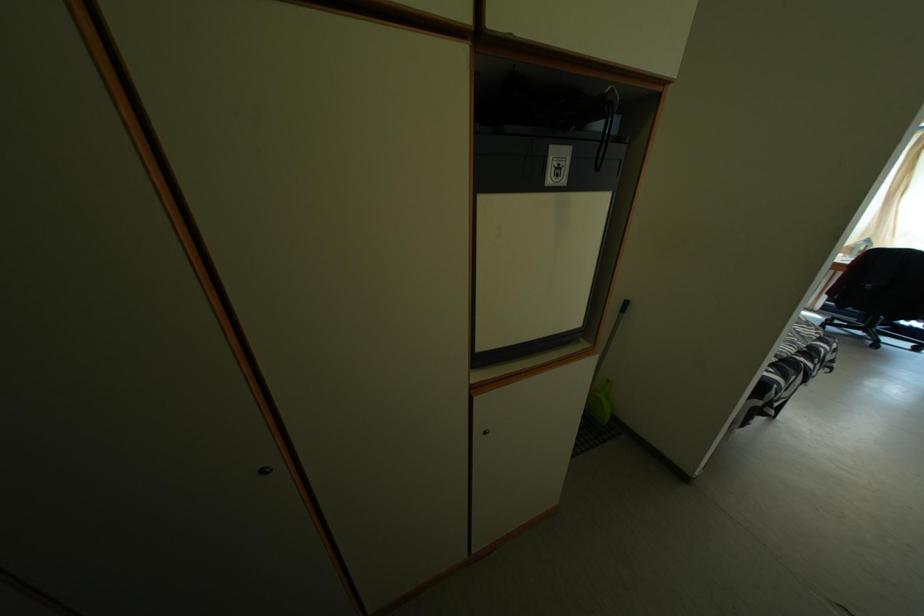
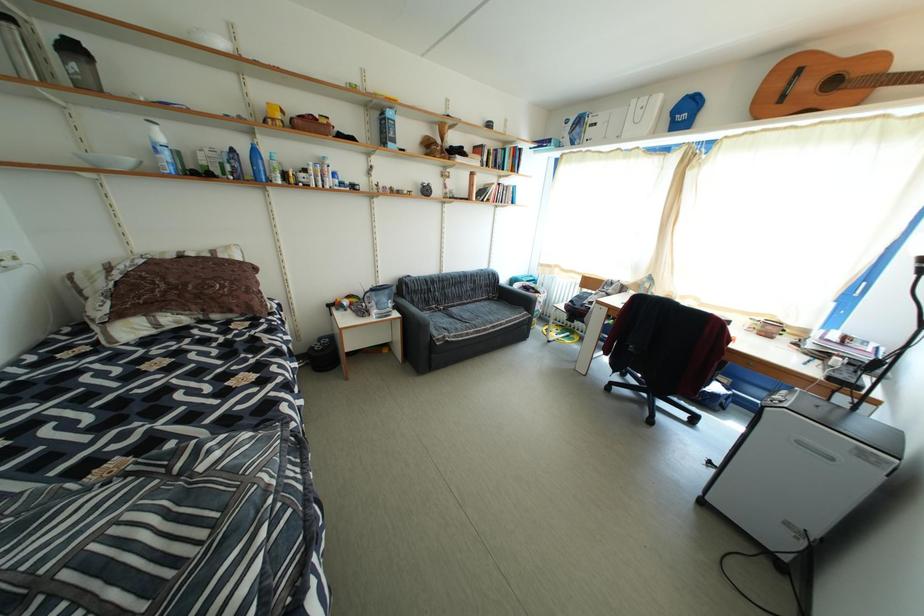
In a continuous first-person perspective shot, in which direction is the camera moving?

The movement direction of the cameraman is right, forward.